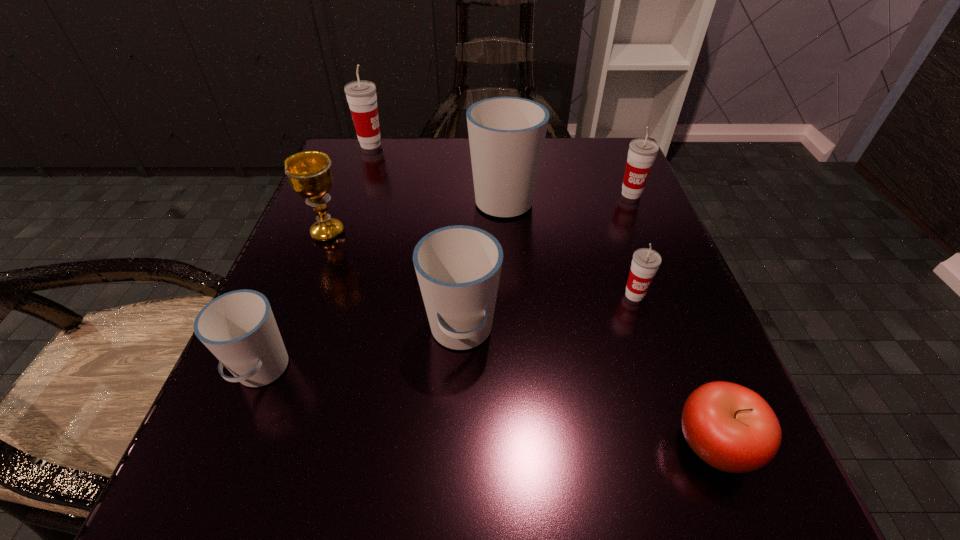
What are the coordinates of `the nearest object` in the screenshot? It's located at (733, 429).

At what (x,y) coordinates should I click in order to perform the action: click on apple. Please return your answer as a coordinate pair (x, y). Image resolution: width=960 pixels, height=540 pixels. Looking at the image, I should click on (733, 429).

Locate an element on the screen. The image size is (960, 540). vacant region located on the side of the farthest cup with the logo is located at coordinates pyautogui.click(x=528, y=145).

Locate an element on the screen. The image size is (960, 540). vacant space located 0.060m with a handle on the side of the biggest white cup is located at coordinates point(501,161).

Where is `vacant area located on the right of the gold chalice`? This screenshot has height=540, width=960. vacant area located on the right of the gold chalice is located at coordinates (566, 233).

Where is `blank space located 0.140m on the side of the rightmost red cup with the logo`? The height and width of the screenshot is (540, 960). blank space located 0.140m on the side of the rightmost red cup with the logo is located at coordinates (655, 249).

Find the location of a particular element. Image resolution: width=960 pixels, height=540 pixels. blank space located with a handle on the side of the second biggest white cup is located at coordinates (457, 436).

Identify the location of vacant area situated with a handle on the side of the smallest white cup. (232, 444).

You are a GUI agent. You are given a task and a screenshot of the screen. Output one action in this format:
    pyautogui.click(x=<x>, y=<y>)
    Task: Click on the vacant space situated on the side of the smallest red cup with the logo
    
    Given the screenshot: What is the action you would take?
    pyautogui.click(x=714, y=532)

This screenshot has height=540, width=960. What are the coordinates of `free spot located on the back of the apple` in the screenshot? It's located at (639, 247).